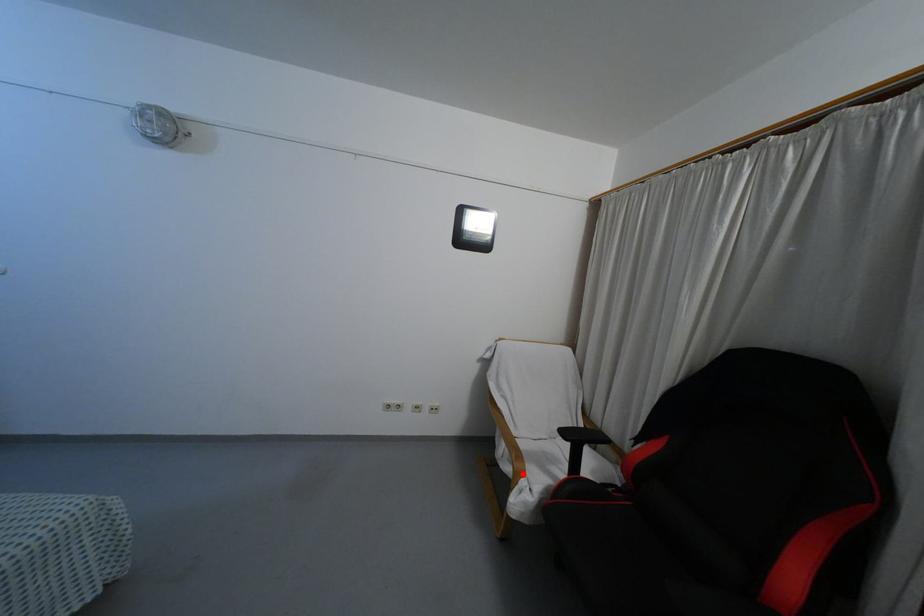
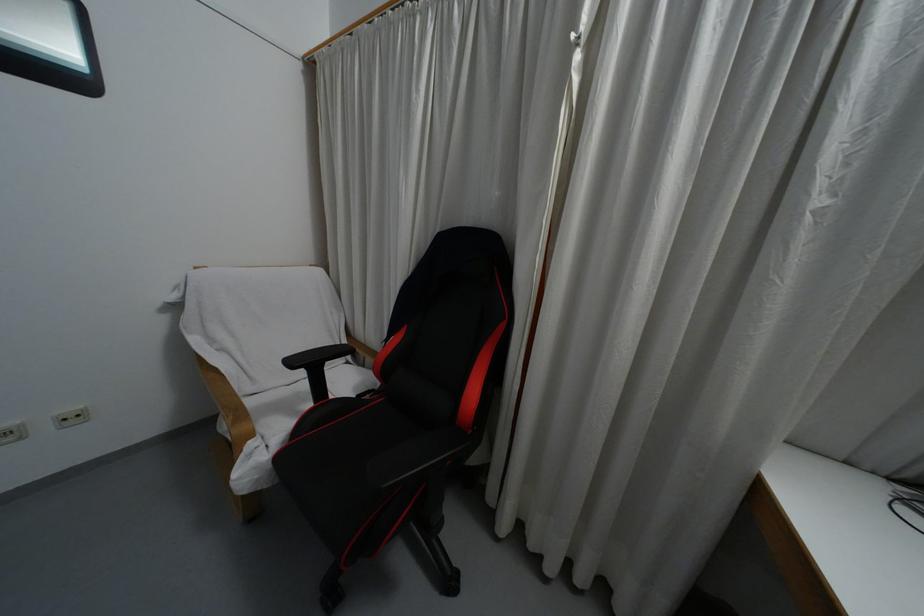
Where in the second image is the point corresponding to the highlighted location from the first image?

(250, 435)